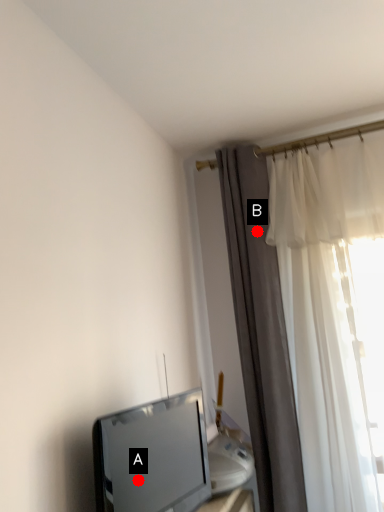
Question: Two points are circled on the image, labeled by A and B beside each circle. Which point is further to the camera?

Choices:
 (A) A is further
 (B) B is further

Answer: (B)